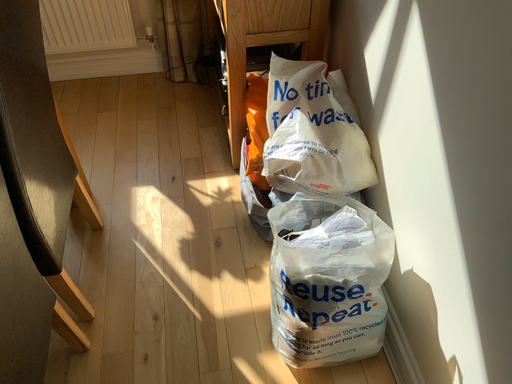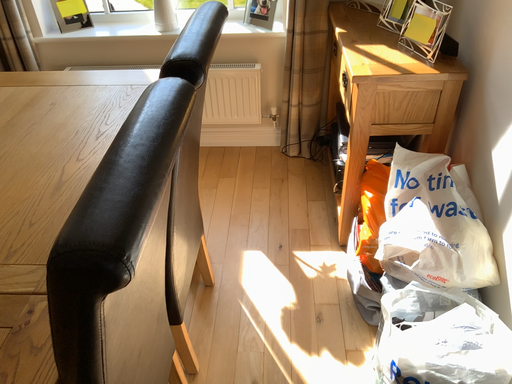
Question: Which way did the camera rotate in the video?

Choices:
 (A) rotated upward
 (B) rotated downward

Answer: (A)